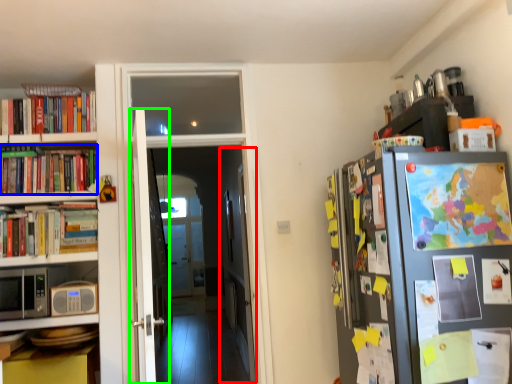
Question: Which is nearer to the door (highlighted by a red box)? book (highlighted by a blue box) or door (highlighted by a green box).

Choices:
 (A) book
 (B) door

Answer: (A)